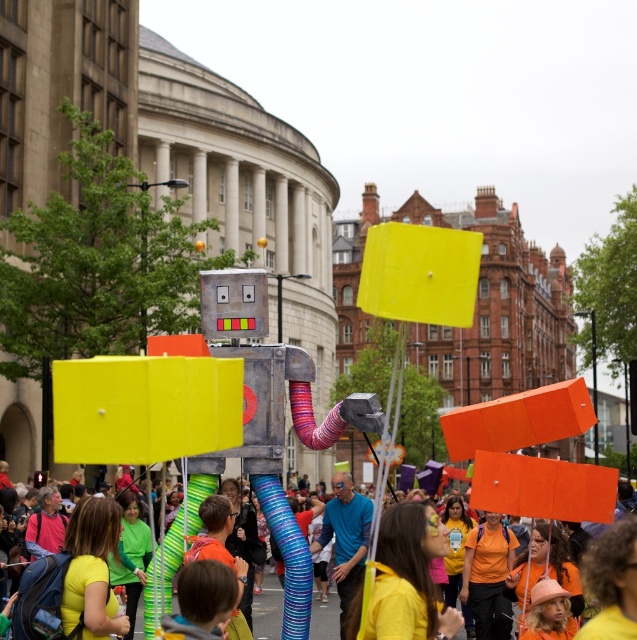
You are a participant in the parade and want to know which fabric is shorter between the yellow fabric headband at center and the blue fabric at center. Which one is shorter?

The yellow fabric headband at center is shorter than the blue fabric at center.

You are a participant in the parade and you see the blue fabric at center and the orange cardboard sign at center. Which object is covering the other one?

The blue fabric at center is positioned over the orange cardboard sign at center, so the blue fabric is covering the orange cardboard sign.